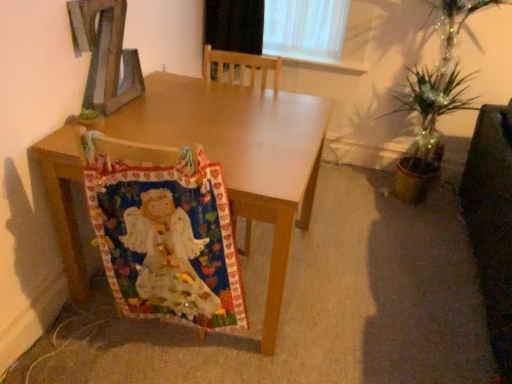
Question: Is point (132, 200) closer or farther from the camera than point (238, 215)?

Choices:
 (A) closer
 (B) farther

Answer: (A)

Question: In terms of size, does multicolored fabric at lower left appear bigger or smaller than wooden table at center?

Choices:
 (A) big
 (B) small

Answer: (B)

Question: Which is farther from the multicolored fabric at lower left?

Choices:
 (A) wooden table at center
 (B) dark brown leather swivel chair at right
 (C) wooden letter z at upper left

Answer: (B)

Question: Which is farther from the multicolored fabric at lower left?

Choices:
 (A) dark brown leather swivel chair at right
 (B) wooden table at center
 (C) wooden letter z at upper left

Answer: (A)